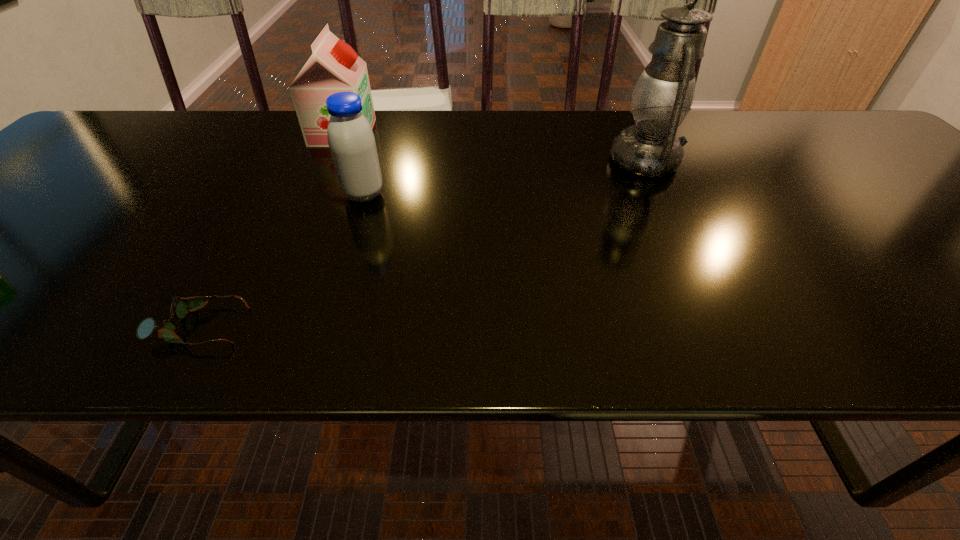
Locate an element on the screen. This screenshot has height=540, width=960. the rightmost object is located at coordinates (663, 95).

You are a GUI agent. You are given a task and a screenshot of the screen. Output one action in this format:
    pyautogui.click(x=<x>, y=<y>)
    Task: Click on the oil lamp
    
    Given the screenshot: What is the action you would take?
    pyautogui.click(x=663, y=95)

Image resolution: width=960 pixels, height=540 pixels. I want to click on the farther soya milk, so click(334, 66).

I want to click on the nearer soya milk, so click(x=352, y=144).

Identify the location of the shortest object. This screenshot has width=960, height=540. (180, 307).

The image size is (960, 540). Identify the location of spectacles. (180, 307).

The width and height of the screenshot is (960, 540). Identify the location of vacant space located on the front of the oil lamp. (725, 325).

Image resolution: width=960 pixels, height=540 pixels. In order to click on vacant space situated with the cap open on the farther soya milk in this screenshot , I will do (480, 132).

The height and width of the screenshot is (540, 960). In order to click on vacant region located on the left of the nearer soya milk in this screenshot , I will do `click(279, 194)`.

This screenshot has width=960, height=540. Find the location of `free point located 0.290m on the front-facing side of the spectacles`. free point located 0.290m on the front-facing side of the spectacles is located at coordinates (420, 326).